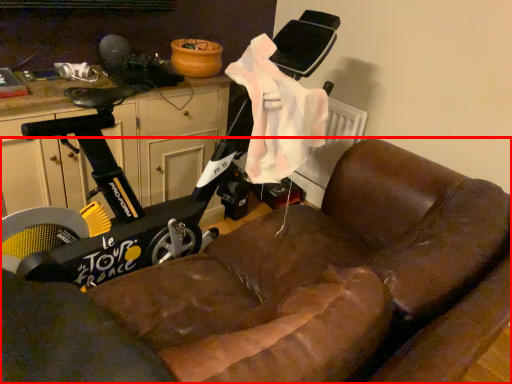
Question: From the image's perspective, considering the relative positions of studio couch (annotated by the red box) and dresser in the image provided, where is studio couch (annotated by the red box) located with respect to the staircase?

Choices:
 (A) below
 (B) above

Answer: (A)